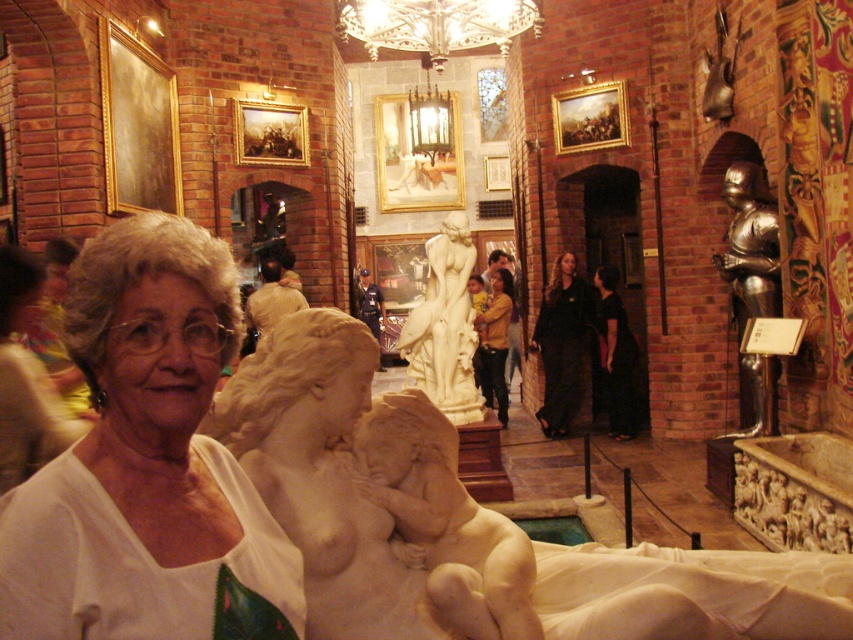
Which is more to the left, white fabric at center or black satin dress at center?

From the viewer's perspective, white fabric at center appears more on the left side.

Does white fabric at center appear on the left side of black satin dress at center?

Indeed, white fabric at center is positioned on the left side of black satin dress at center.

Who is more distant from viewer, (219, 528) or (602, 342)?

Point (602, 342)

At what (x,y) coordinates should I click in order to perform the action: click on white fabric at center. Please return your answer as a coordinate pair (x, y). Image resolution: width=853 pixels, height=640 pixels. Looking at the image, I should click on (148, 464).

Does point (12, 538) come behind point (439, 134)?

That is False.

Which is more to the left, white fabric at center or gold-framed mirror at upper center?

white fabric at center is more to the left.

Which is behind, point (132, 419) or point (427, 131)?

The point (427, 131) is behind.

What are the coordinates of `white fabric at center` in the screenshot? It's located at (148, 464).

Between point (358, 392) and point (584, 147), which one is positioned in front?

Point (358, 392)

Between point (532, 620) and point (578, 113), which one is positioned behind?

The point (578, 113) is more distant.

Locate an element on the screen. matte white statue at center is located at coordinates (358, 490).